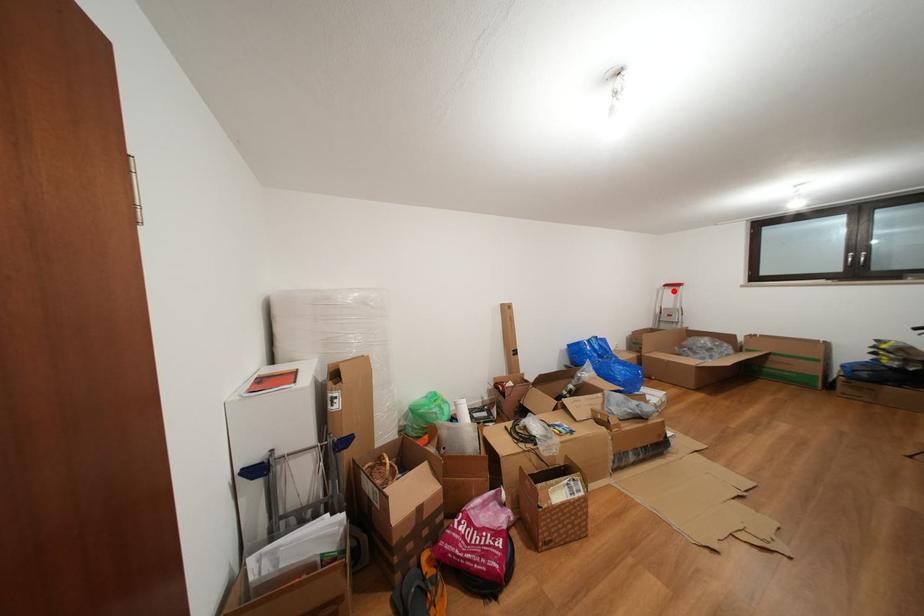
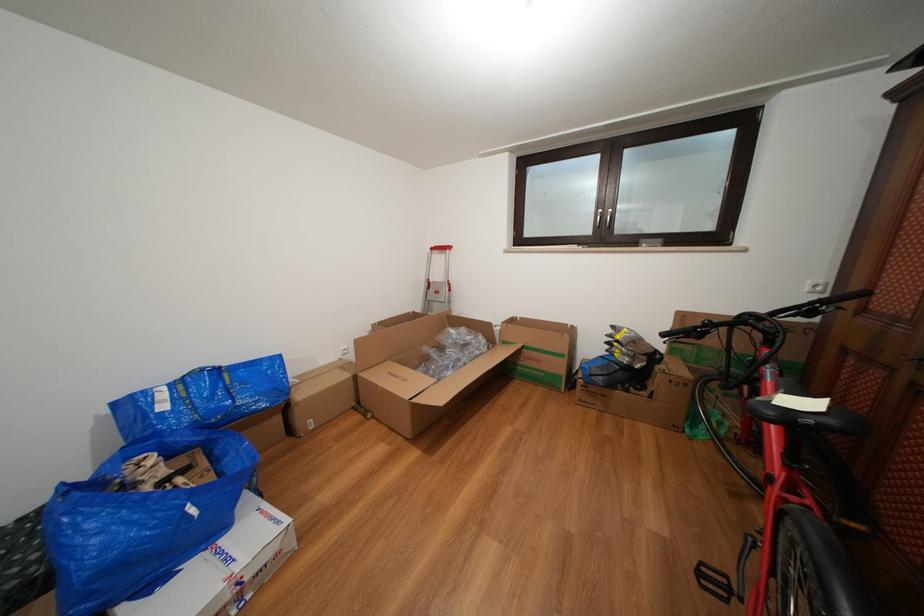
Question: I am providing you with two images of the same scene from different viewpoints. Image1 has a red point marked. In image2, the corresponding 3D location appears at what relative position? Reply with the corresponding letter.

Choices:
 (A) Closer
 (B) Farther

Answer: (A)